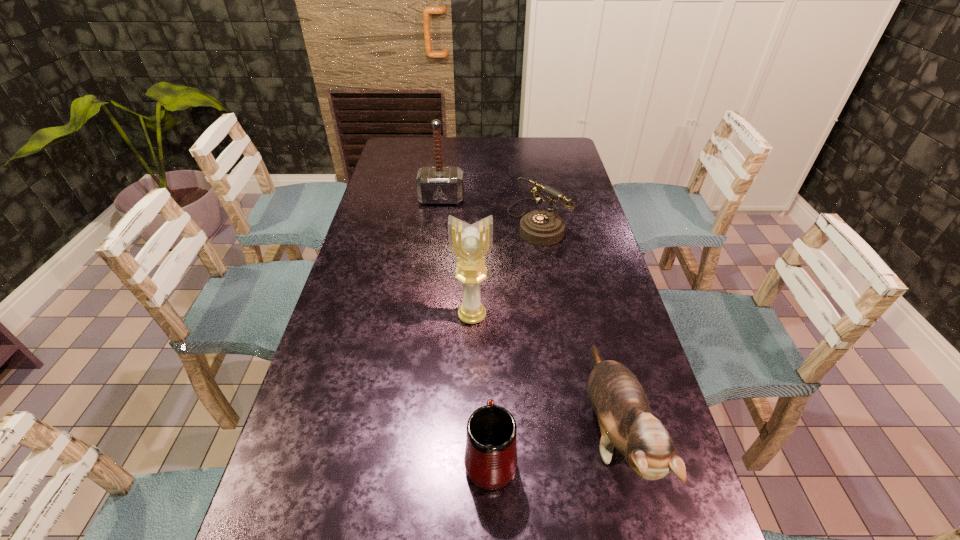
The width and height of the screenshot is (960, 540). What are the coordinates of `the third farthest object` in the screenshot? It's located at (471, 244).

The height and width of the screenshot is (540, 960). I want to click on hammer, so click(435, 185).

The width and height of the screenshot is (960, 540). Find the location of `cat`. cat is located at coordinates coord(618,399).

I want to click on telephone, so click(x=540, y=227).

Locate an element on the screen. mug is located at coordinates (490, 459).

This screenshot has height=540, width=960. Identify the location of free location located on the front-facing side of the award. (471, 369).

Where is `vacant space located 0.240m on the front of the hammer`? The height and width of the screenshot is (540, 960). vacant space located 0.240m on the front of the hammer is located at coordinates [x=436, y=247].

This screenshot has width=960, height=540. Identify the location of free space located on the left of the telephone. (435, 221).

Image resolution: width=960 pixels, height=540 pixels. Identify the location of vacant space located 0.330m on the side of the mug with the handle. (488, 317).

Identify the location of vacant area located 0.060m on the side of the mug with the handle. (490, 402).